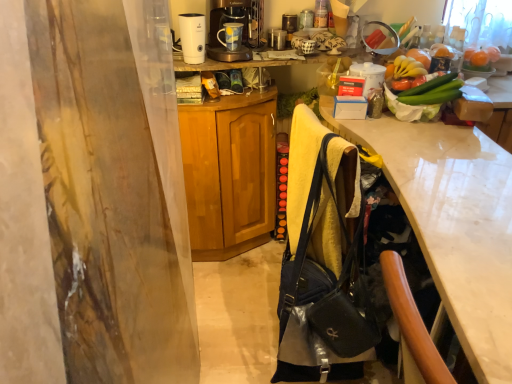
Question: Which direction should I rotate to look at metallic silver coffee maker at upper center, arranged as the second appliance when ordered from the bottom?

Choices:
 (A) right
 (B) left

Answer: (A)

Question: Considering the relative positions of matte black handbag at center and metallic silver coffee maker at upper center in the image provided, is matte black handbag at center to the right of metallic silver coffee maker at upper center from the viewer's perspective?

Choices:
 (A) no
 (B) yes

Answer: (B)

Question: Does matte black handbag at center have a greater height compared to metallic silver coffee maker at upper center?

Choices:
 (A) no
 (B) yes

Answer: (B)

Question: Is metallic silver coffee maker at upper center inside matte black handbag at center?

Choices:
 (A) yes
 (B) no

Answer: (B)

Question: Can you confirm if matte black handbag at center is bigger than metallic silver coffee maker at upper center?

Choices:
 (A) yes
 (B) no

Answer: (A)

Question: Are matte black handbag at center and metallic silver coffee maker at upper center located far from each other?

Choices:
 (A) no
 (B) yes

Answer: (B)

Question: Are matte black handbag at center and metallic silver coffee maker at upper center making contact?

Choices:
 (A) yes
 (B) no

Answer: (B)

Question: Could you tell me if wooden cabinet at center is facing white glossy desk at right?

Choices:
 (A) yes
 (B) no

Answer: (B)

Question: Can you confirm if wooden cabinet at center is thinner than white glossy desk at right?

Choices:
 (A) no
 (B) yes

Answer: (B)

Question: Considering the relative positions of wooden cabinet at center and white glossy desk at right in the image provided, is wooden cabinet at center behind white glossy desk at right?

Choices:
 (A) no
 (B) yes

Answer: (B)

Question: From the image's perspective, is wooden cabinet at center under white glossy desk at right?

Choices:
 (A) yes
 (B) no

Answer: (B)

Question: From the image's perspective, does wooden cabinet at center appear higher than white glossy desk at right?

Choices:
 (A) yes
 (B) no

Answer: (A)

Question: Is wooden cabinet at center next to white glossy desk at right and touching it?

Choices:
 (A) yes
 (B) no

Answer: (B)

Question: Is the position of orange matte fruit at upper right more distant than that of wooden cabinet at center?

Choices:
 (A) yes
 (B) no

Answer: (A)